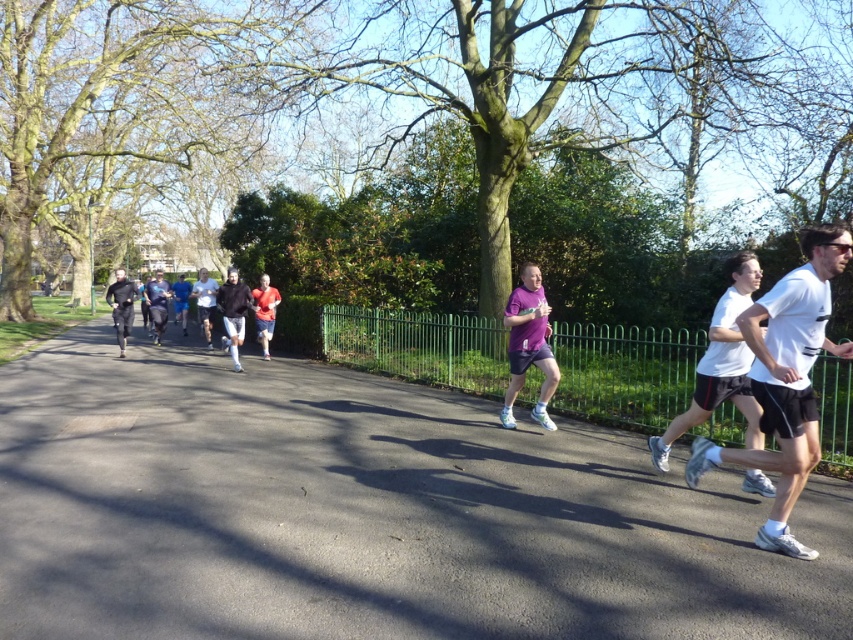
Consider the image. You are a photographer positioned at the starting line of the race. You want to take a photo that includes both the purple matte shorts at center and the white matte shirt at center. Which one should you adjust your camera angle to focus on first to ensure both are in frame?

The purple matte shorts at center is located below the white matte shirt at center, so you should focus on the white matte shirt at center first to ensure both are in frame.

You are a runner participating in a race and you see the asphalt road at center and the dark gray running attire at center. Which object is located below the other?

The asphalt road at center is positioned under the dark gray running attire at center, so the asphalt road is below the dark gray running attire.